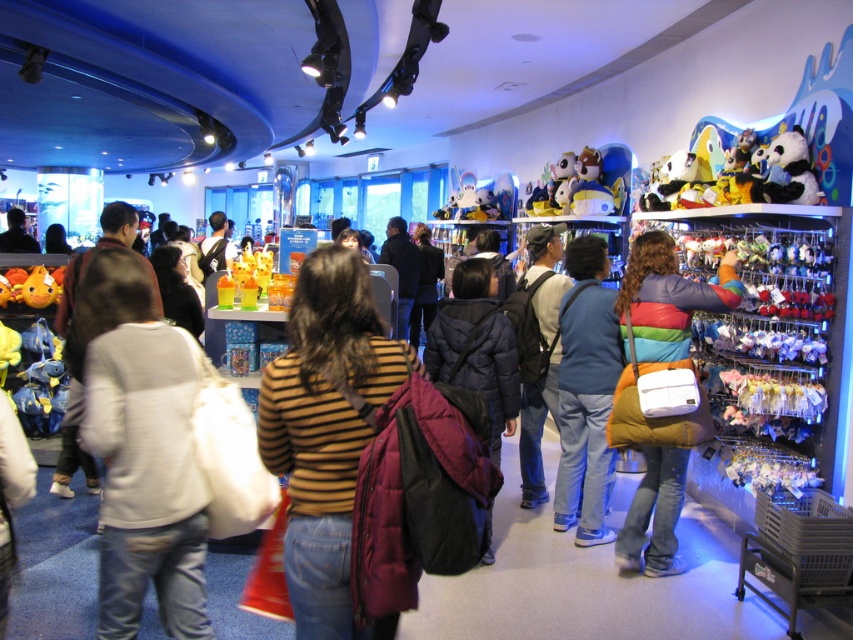
Is dark brown backpack at center shorter than white matte jacket at center?

In fact, dark brown backpack at center may be taller than white matte jacket at center.

Is point (540, 371) positioned behind point (65, 296)?

No, (540, 371) is closer to viewer.

Between point (531, 496) and point (74, 397), which one is positioned in front?

Positioned in front is point (74, 397).

The width and height of the screenshot is (853, 640). In order to click on dark brown backpack at center in this screenshot , I will do `click(543, 355)`.

Can you confirm if white matte jacket at center is thinner than soft plush toy at upper center?

No, white matte jacket at center is not thinner than soft plush toy at upper center.

Can you confirm if white matte jacket at center is positioned above soft plush toy at upper center?

No.

Is point (62, 416) closer to viewer compared to point (602, 208)?

Yes.

The height and width of the screenshot is (640, 853). In order to click on white matte jacket at center in this screenshot , I will do `click(90, 257)`.

Is point (569, 305) positioned in front of point (792, 164)?

No, (569, 305) is further to viewer.

Who is more forward, (602,308) or (817,195)?

Point (817,195)

Find the location of a particular element. blue denim jeans at center is located at coordinates pyautogui.click(x=585, y=394).